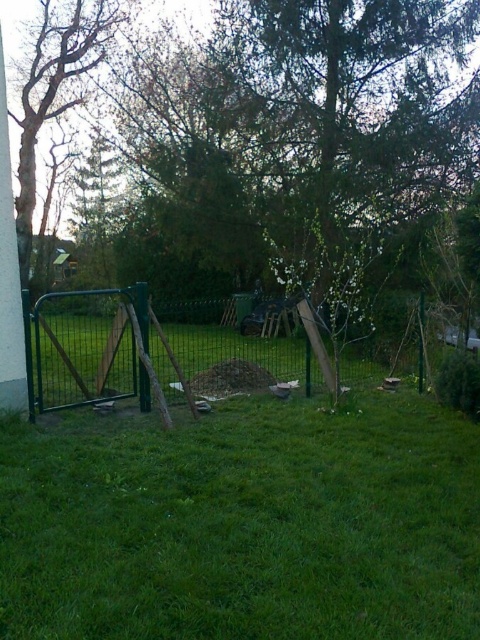
Question: Does green metal fence at left appear over smooth bark tree at left?

Choices:
 (A) no
 (B) yes

Answer: (A)

Question: Which point is farther to the camera?

Choices:
 (A) (50, 12)
 (B) (315, 387)

Answer: (A)

Question: From the image, what is the correct spatial relationship of green metal fence at left in relation to smooth bark tree at left?

Choices:
 (A) above
 (B) below

Answer: (B)

Question: Can you confirm if green metal fence at left is thinner than smooth bark tree at left?

Choices:
 (A) yes
 (B) no

Answer: (B)

Question: Which point is farther from the camera taking this photo?

Choices:
 (A) (140, 326)
 (B) (76, 65)

Answer: (B)